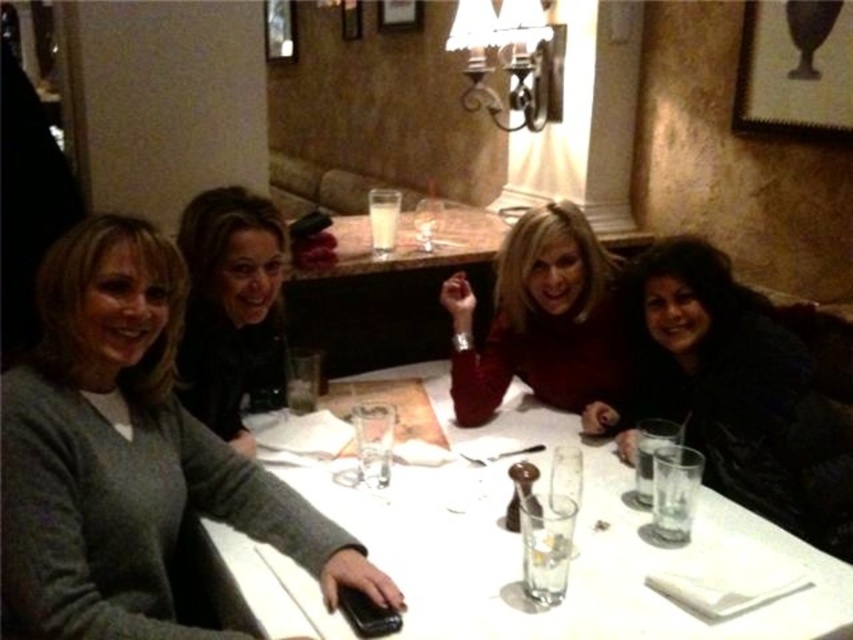
Question: Does gray sweater at left have a larger size compared to black fuzzy coat at lower right?

Choices:
 (A) no
 (B) yes

Answer: (B)

Question: Among these objects, which one is farthest from the camera?

Choices:
 (A) dark brown hair at upper left
 (B) gray sweater at left
 (C) white glossy table at center

Answer: (A)

Question: Is gray sweater at left closer to camera compared to white glossy table at center?

Choices:
 (A) no
 (B) yes

Answer: (B)

Question: Does black fuzzy coat at lower right have a lesser width compared to clear glass wine glass at center?

Choices:
 (A) no
 (B) yes

Answer: (A)

Question: Which point is farther from the camera taking this photo?

Choices:
 (A) (601, 547)
 (B) (730, 397)
 (C) (518, 276)

Answer: (C)

Question: Based on their relative distances, which object is nearer to the dark brown hair at upper left?

Choices:
 (A) matte red sweater at center
 (B) white glossy table at center

Answer: (B)